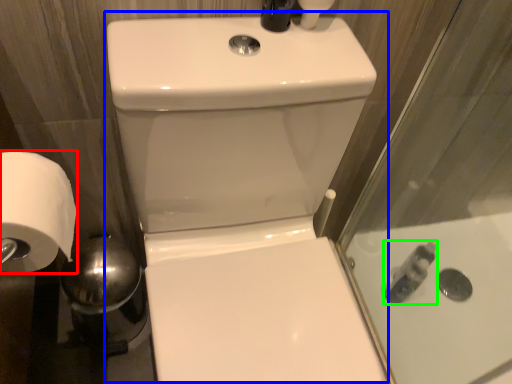
Question: Which is nearer to the toilet paper (highlighted by a red box)? sink (highlighted by a blue box) or toiletry (highlighted by a green box).

Choices:
 (A) sink
 (B) toiletry

Answer: (A)